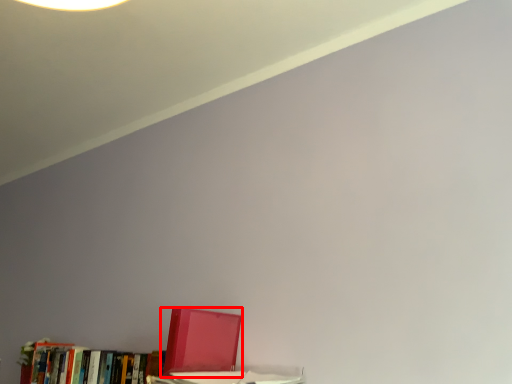
Question: From the image, what is the correct spatial relationship of book (annotated by the red box) in relation to book?

Choices:
 (A) left
 (B) right

Answer: (B)